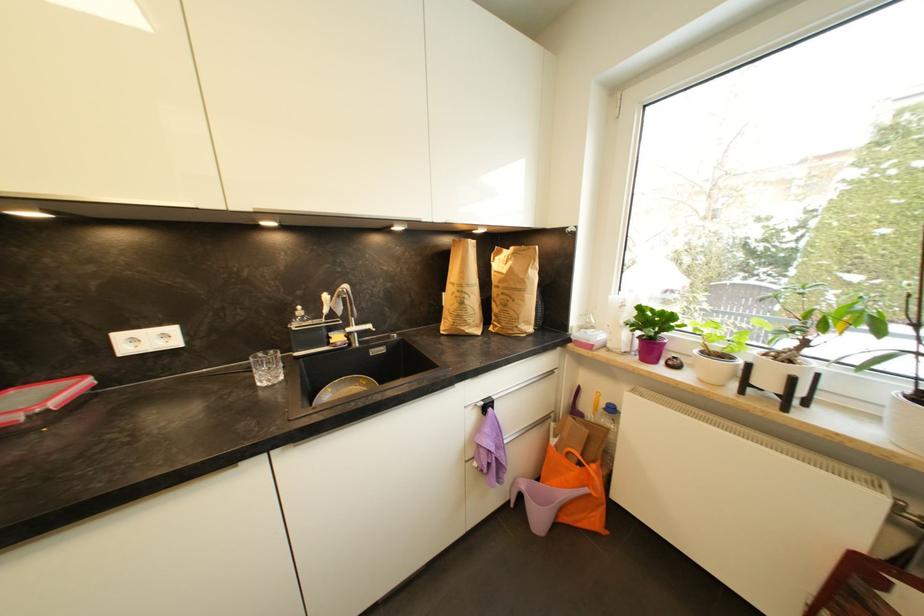
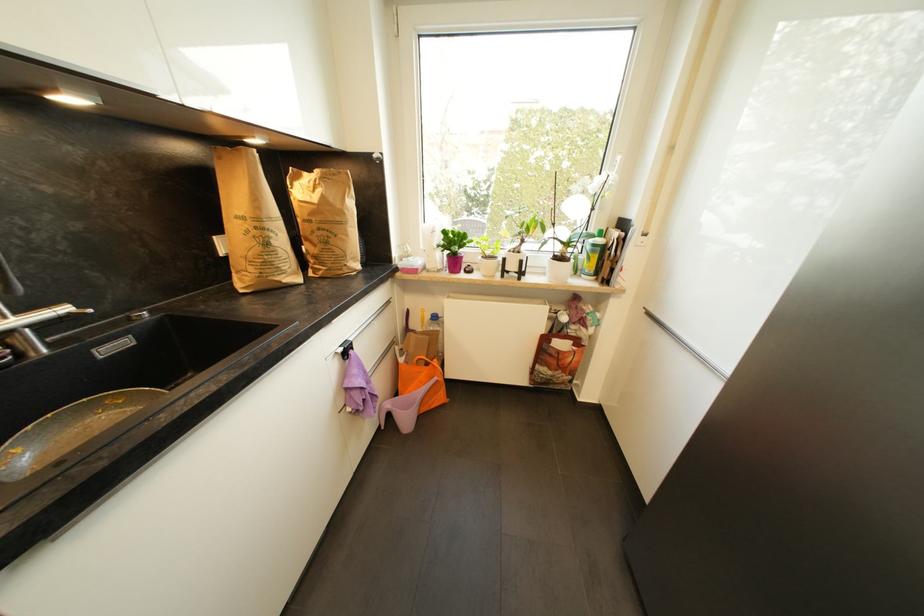
Locate, in the second image, the point that corresponds to point 467,305 in the first image.

(272, 246)